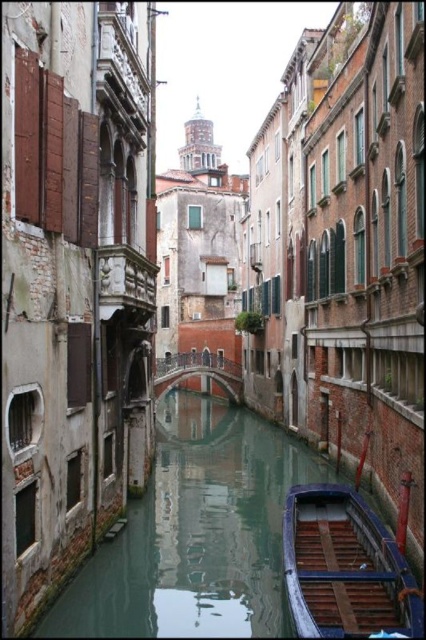
Question: Can you confirm if green smooth water at center is positioned to the right of wooden boat at lower center?

Choices:
 (A) no
 (B) yes

Answer: (A)

Question: Which point is farther from the camera taking this photo?

Choices:
 (A) (311, 522)
 (B) (189, 486)

Answer: (B)

Question: Does green smooth water at center have a greater width compared to wooden boat at lower center?

Choices:
 (A) no
 (B) yes

Answer: (B)

Question: Can you confirm if green smooth water at center is positioned to the left of wooden boat at lower center?

Choices:
 (A) yes
 (B) no

Answer: (A)